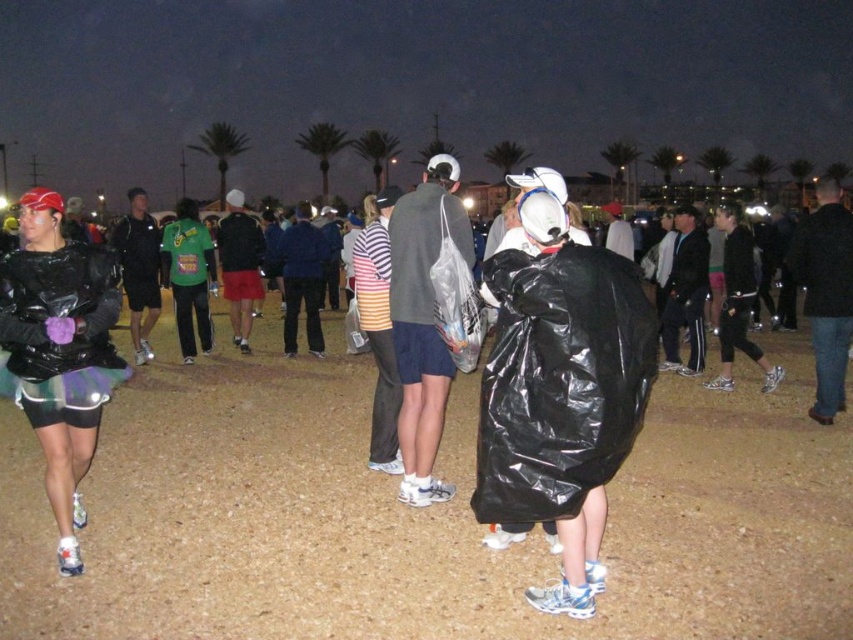
Question: Which object appears farthest from the camera in this image?

Choices:
 (A) matte gray jacket at center
 (B) black plastic bag at center
 (C) matte black jacket at left

Answer: (A)

Question: Can you confirm if black plastic bag at center is positioned above matte black jacket at left?

Choices:
 (A) no
 (B) yes

Answer: (B)

Question: Among these objects, which one is farthest from the camera?

Choices:
 (A) matte black jacket at left
 (B) matte gray jacket at center
 (C) black plastic bag at center

Answer: (B)

Question: Which object is positioned farthest from the black plastic bag at center?

Choices:
 (A) matte gray jacket at center
 (B) matte black jacket at left

Answer: (B)

Question: Can you confirm if black plastic bag at center is bigger than matte black jacket at left?

Choices:
 (A) no
 (B) yes

Answer: (B)

Question: Can you confirm if black plastic bag at center is wider than matte gray jacket at center?

Choices:
 (A) yes
 (B) no

Answer: (A)